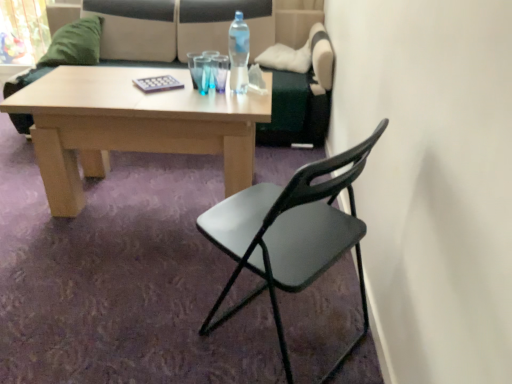
Identify the location of vacant space situated on the left part of black plastic chair at center. Image resolution: width=512 pixels, height=384 pixels. (151, 313).